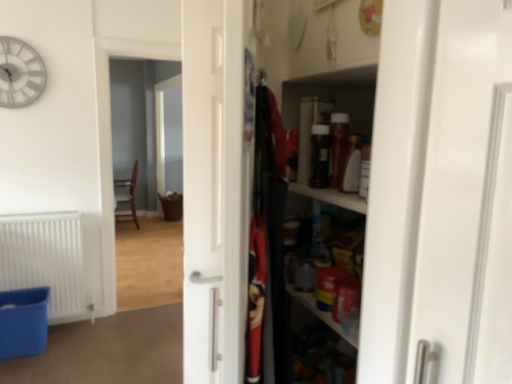
Question: From the image's perspective, is wooden shelves at right under brown woven basket at center?

Choices:
 (A) yes
 (B) no

Answer: (A)

Question: Is wooden shelves at right directly adjacent to brown woven basket at center?

Choices:
 (A) yes
 (B) no

Answer: (B)

Question: Would you say wooden shelves at right is outside brown woven basket at center?

Choices:
 (A) no
 (B) yes

Answer: (B)

Question: From a real-world perspective, is wooden shelves at right positioned over brown woven basket at center based on gravity?

Choices:
 (A) yes
 (B) no

Answer: (A)

Question: Is the depth of wooden shelves at right greater than that of brown woven basket at center?

Choices:
 (A) no
 (B) yes

Answer: (A)

Question: Based on their positions, is white matte radiator at lower left located to the left or right of blue plastic laundry basket at lower left?

Choices:
 (A) left
 (B) right

Answer: (B)

Question: Looking at the image, does white matte radiator at lower left seem bigger or smaller compared to blue plastic laundry basket at lower left?

Choices:
 (A) small
 (B) big

Answer: (B)

Question: Would you say white matte radiator at lower left is inside or outside blue plastic laundry basket at lower left?

Choices:
 (A) outside
 (B) inside

Answer: (A)

Question: From the image's perspective, is white matte radiator at lower left located above or below blue plastic laundry basket at lower left?

Choices:
 (A) below
 (B) above

Answer: (B)

Question: Looking at their shapes, would you say wooden chair at left is wider or thinner than brown woven basket at center?

Choices:
 (A) thin
 (B) wide

Answer: (B)

Question: In the image, is wooden chair at left positioned in front of or behind brown woven basket at center?

Choices:
 (A) front
 (B) behind

Answer: (B)

Question: Is wooden chair at left bigger or smaller than brown woven basket at center?

Choices:
 (A) small
 (B) big

Answer: (A)

Question: Would you say wooden chair at left is to the left or to the right of brown woven basket at center in the picture?

Choices:
 (A) right
 (B) left

Answer: (B)

Question: Is point (28, 304) closer or farther from the camera than point (121, 183)?

Choices:
 (A) closer
 (B) farther

Answer: (A)

Question: Considering the positions of blue plastic laundry basket at lower left and wooden chair at left in the image, is blue plastic laundry basket at lower left wider or thinner than wooden chair at left?

Choices:
 (A) thin
 (B) wide

Answer: (A)